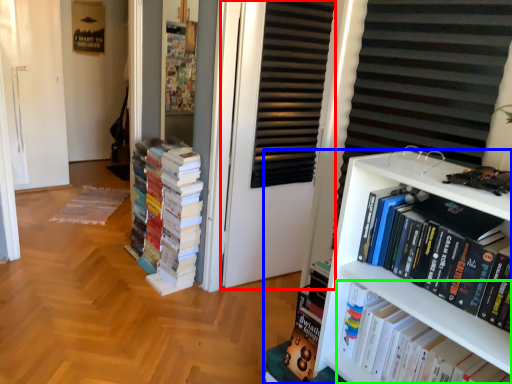
Question: Based on their relative distances, which object is farther from screen door (highlighted by a red box)? Choose from bookcase (highlighted by a blue box) and book (highlighted by a green box).

Choices:
 (A) bookcase
 (B) book

Answer: (B)